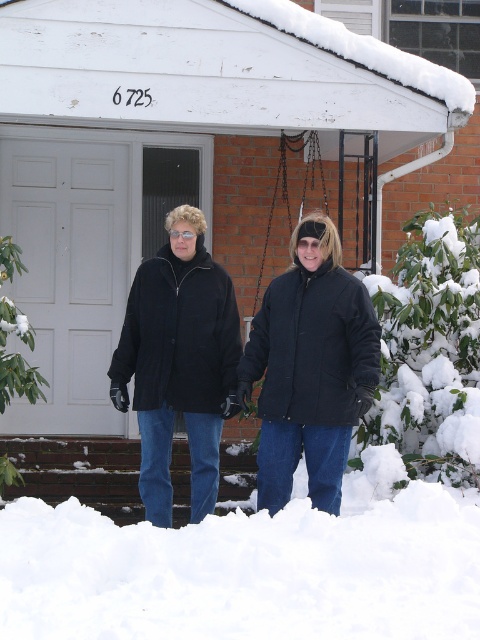
Can you confirm if black matte jackets at center is wider than matte black jacket at center?

Yes, black matte jackets at center is wider than matte black jacket at center.

Can you confirm if black matte jackets at center is positioned to the left of matte black jacket at center?

Yes, black matte jackets at center is to the left of matte black jacket at center.

Is point (173, 316) more distant than point (314, 294)?

Yes, it is behind point (314, 294).

Identify the location of black matte jackets at center. (241, 358).

Is white fluffy snow at lower center taller than black matte jacket at center?

No, white fluffy snow at lower center is not taller than black matte jacket at center.

Looking at this image, is white fluffy snow at lower center in front of black matte jacket at center?

Yes.

Between point (354, 564) and point (169, 284), which one is positioned behind?

Positioned behind is point (169, 284).

This screenshot has height=640, width=480. What are the coordinates of `white fluffy snow at lower center` in the screenshot? It's located at (245, 572).

Who is taller, black matte jackets at center or black matte jacket at center?

black matte jacket at center is taller.

Looking at this image, can you confirm if black matte jackets at center is positioned below black matte jacket at center?

Correct, black matte jackets at center is located below black matte jacket at center.

Identify the location of black matte jackets at center. (241, 358).